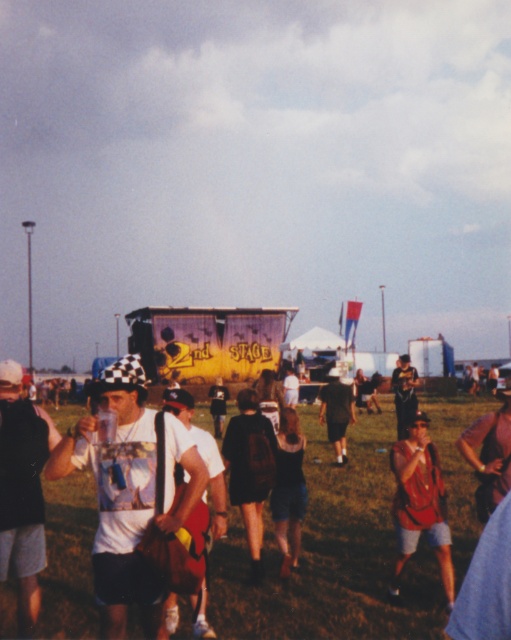
Question: In this image, where is white matte t-shirt at center located relative to dark brown backpack at center?

Choices:
 (A) left
 (B) right

Answer: (A)

Question: Is dark brown backpack at center bigger than dark green shorts at center?

Choices:
 (A) yes
 (B) no

Answer: (B)

Question: Can you confirm if matte red shirt at center is wider than dark brown backpack at center?

Choices:
 (A) yes
 (B) no

Answer: (A)

Question: Which object is the closest to the black matte shirt at left?

Choices:
 (A) dark brown backpack at center
 (B) dark brown leather jacket at center
 (C) matte red shirt at center

Answer: (A)

Question: Which of the following is the closest to the observer?

Choices:
 (A) (119, 534)
 (B) (423, 420)
 (C) (485, 413)
 (D) (41, 561)

Answer: (A)

Question: Which object appears closest to the camera in this image?

Choices:
 (A) dark green shorts at center
 (B) dark brown backpack at center
 (C) matte red shirt at center

Answer: (C)